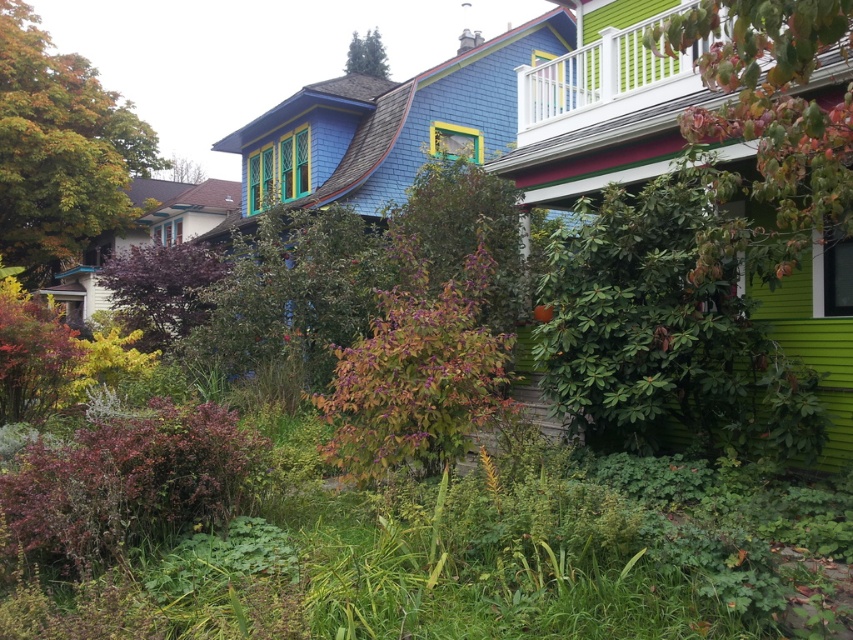
Question: Which object is the farthest from the green textured bush at center?

Choices:
 (A) purple glossy tree at left
 (B) green textured tree at upper center
 (C) green matte leaves at upper right
 (D) green leafy bush at right

Answer: (B)

Question: Which point is farther to the camera?

Choices:
 (A) (842, 28)
 (B) (368, 224)
 (C) (795, 262)

Answer: (B)

Question: Does green matte leaves at upper right have a smaller size compared to brown wood tree at upper left?

Choices:
 (A) yes
 (B) no

Answer: (A)

Question: Does green matte leaves at upper right have a larger size compared to green matte bush at lower left?

Choices:
 (A) no
 (B) yes

Answer: (A)

Question: Does green matte leaves at upper right have a greater width compared to green matte bush at lower left?

Choices:
 (A) no
 (B) yes

Answer: (A)

Question: Which object appears closest to the camera in this image?

Choices:
 (A) green matte bush at lower left
 (B) green textured bush at center

Answer: (A)